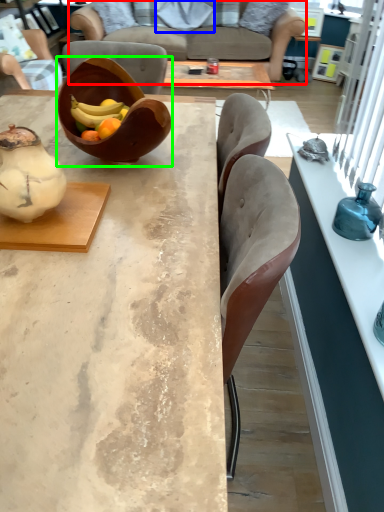
Question: Which object is positioned farthest from studio couch (highlighted by a red box)? Select from pillow (highlighted by a blue box) and bowl (highlighted by a green box).

Choices:
 (A) pillow
 (B) bowl

Answer: (B)